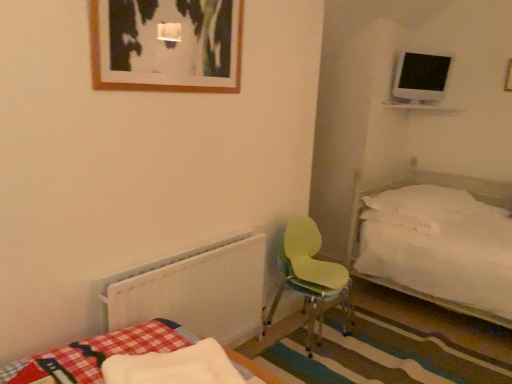
Question: Is white soft pillow at right thinner than white fluffy mattress at lower left?

Choices:
 (A) no
 (B) yes

Answer: (A)

Question: From the image's perspective, does white soft pillow at right appear lower than white fluffy mattress at lower left?

Choices:
 (A) no
 (B) yes

Answer: (A)

Question: Considering the relative positions of white soft pillow at right and white fluffy mattress at lower left in the image provided, is white soft pillow at right to the left of white fluffy mattress at lower left from the viewer's perspective?

Choices:
 (A) no
 (B) yes

Answer: (A)

Question: From the image's perspective, is white soft pillow at right over white fluffy mattress at lower left?

Choices:
 (A) yes
 (B) no

Answer: (A)

Question: Considering the relative sizes of white soft pillow at right and white fluffy mattress at lower left in the image provided, is white soft pillow at right bigger than white fluffy mattress at lower left?

Choices:
 (A) yes
 (B) no

Answer: (A)

Question: From the image's perspective, is light green plastic chair at center above or below white fluffy mattress at lower left?

Choices:
 (A) below
 (B) above

Answer: (B)

Question: Is light green plastic chair at center in front of or behind white fluffy mattress at lower left in the image?

Choices:
 (A) front
 (B) behind

Answer: (B)

Question: Considering the positions of light green plastic chair at center and white fluffy mattress at lower left in the image, is light green plastic chair at center bigger or smaller than white fluffy mattress at lower left?

Choices:
 (A) small
 (B) big

Answer: (B)

Question: Is point (334, 291) positioned closer to the camera than point (188, 352)?

Choices:
 (A) farther
 (B) closer

Answer: (A)

Question: In terms of width, does white soft pillow at right look wider or thinner when compared to white fluffy mattress at lower left?

Choices:
 (A) wide
 (B) thin

Answer: (A)

Question: Is white soft pillow at right spatially inside white fluffy mattress at lower left, or outside of it?

Choices:
 (A) outside
 (B) inside

Answer: (A)

Question: Considering their positions, is white soft pillow at right located in front of or behind white fluffy mattress at lower left?

Choices:
 (A) behind
 (B) front

Answer: (A)

Question: Is point (413, 190) closer or farther from the camera than point (110, 375)?

Choices:
 (A) farther
 (B) closer

Answer: (A)

Question: Is point (223, 367) closer or farther from the camera than point (161, 281)?

Choices:
 (A) closer
 (B) farther

Answer: (A)

Question: In terms of height, does white fluffy mattress at lower left look taller or shorter compared to white plastic radiator at lower left?

Choices:
 (A) tall
 (B) short

Answer: (B)